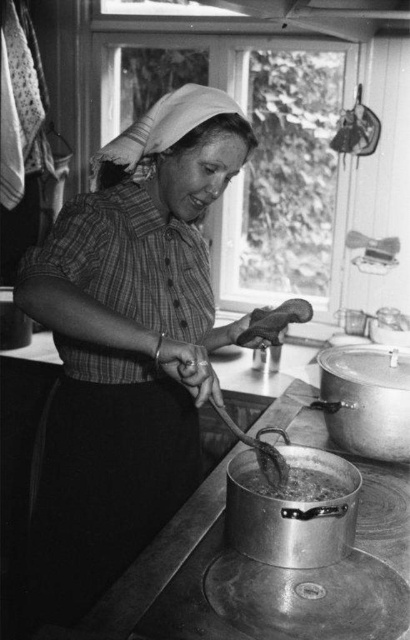
Which is more to the right, matte plaid shirt at center or boiling liquid at lower center?

From the viewer's perspective, boiling liquid at lower center appears more on the right side.

Can you confirm if matte plaid shirt at center is wider than boiling liquid at lower center?

Yes.

Does point (123, 216) come closer to viewer compared to point (264, 483)?

No, (123, 216) is behind (264, 483).

Where is `matte plaid shirt at center`? The width and height of the screenshot is (410, 640). matte plaid shirt at center is located at coordinates (129, 346).